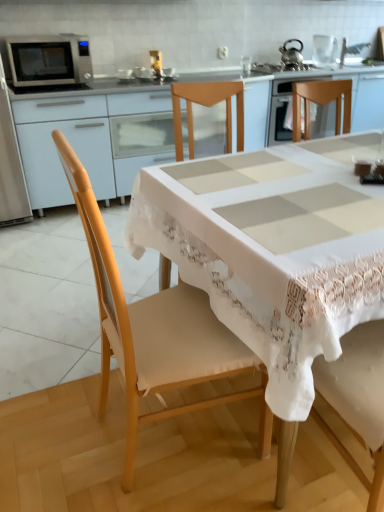
Where is `unoccupied region to the right of metallic gold toaster at upper center, which ranks as the 2th appliance in back-to-front order`? The width and height of the screenshot is (384, 512). unoccupied region to the right of metallic gold toaster at upper center, which ranks as the 2th appliance in back-to-front order is located at coordinates (176, 74).